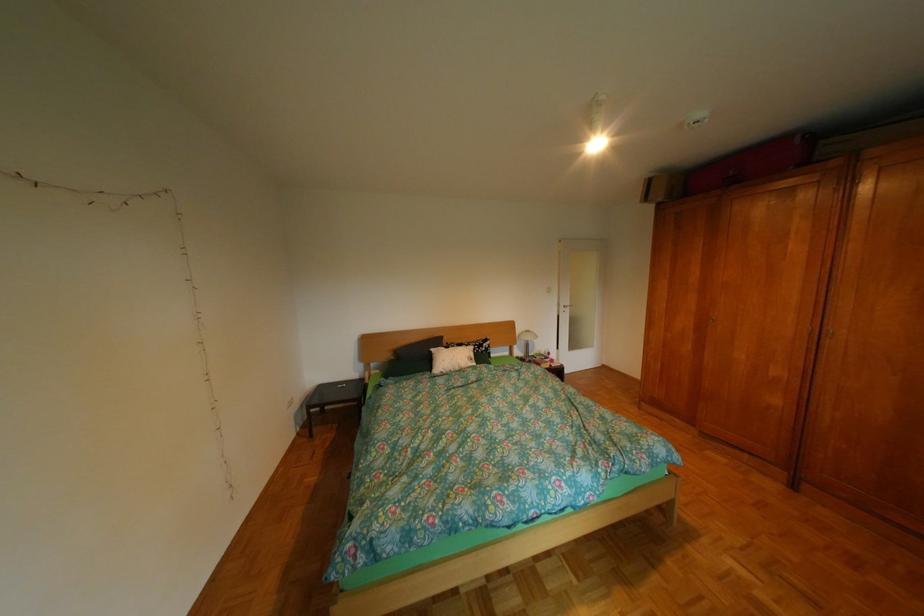
Find the location of a particular element. Image resolution: width=924 pixels, height=616 pixels. red suitcase is located at coordinates (751, 163).